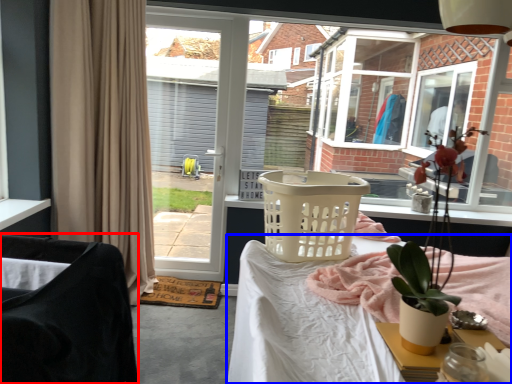
Question: Which point is closer to the camera, chair (highlighted by a red box) or desk (highlighted by a blue box)?

Choices:
 (A) chair
 (B) desk

Answer: (A)